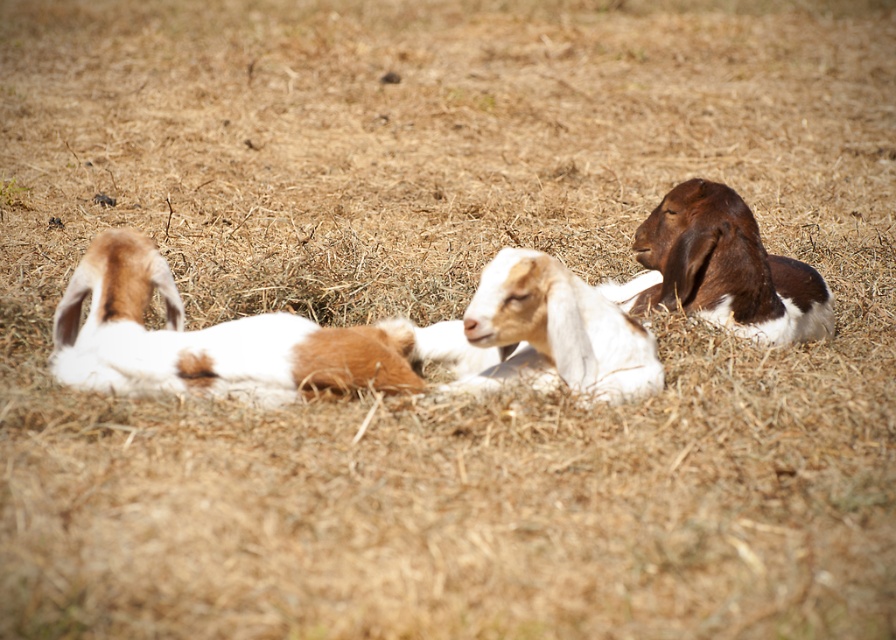
You are standing in a field and see two goats, the brown and white fur goat at left and the brown and white fur at right. Which goat is nearer to you?

The brown and white fur goat at left is closer to the viewer than the brown and white fur at right, so the brown and white fur goat at left is nearer to you.

You are a farmer checking on your goats. You see the brown and white fur goat at left and the white woolen goat at center. Which goat do you need to provide more feed to based on their sizes?

The brown and white fur goat at left is bigger than the white woolen goat at center, so you should provide more feed to the brown and white fur goat at left.